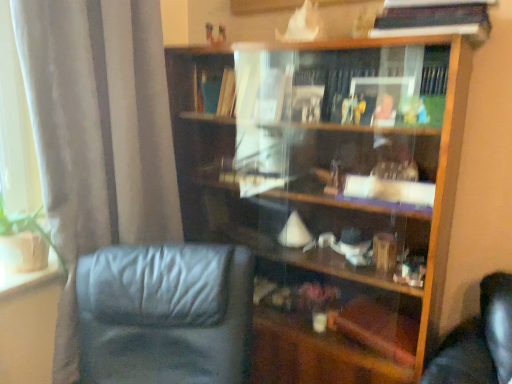
The image size is (512, 384). I want to click on wooden bookcase at center, so click(x=327, y=192).

Describe the element at coordinates (98, 134) in the screenshot. I see `satin gray curtain at left` at that location.

The width and height of the screenshot is (512, 384). Describe the element at coordinates (165, 314) in the screenshot. I see `black leather chair at lower left` at that location.

I want to click on hardcover book at upper right, so click(x=434, y=20).

Is hardcover book at upper right taller or shorter than black leather chair at lower left?

Clearly, hardcover book at upper right is shorter compared to black leather chair at lower left.

Is black leather chair at lower left completely or partially inside hardcover book at upper right?

Answer: Actually, black leather chair at lower left is outside hardcover book at upper right.

Is hardcover book at upper right touching black leather chair at lower left?

No, hardcover book at upper right is not in contact with black leather chair at lower left.

How distant is hardcover book at upper right from black leather chair at lower left?

A distance of 3.53 feet exists between hardcover book at upper right and black leather chair at lower left.

From the image's perspective, between black leather chair at lower left and wooden bookcase at center, who is located below?

black leather chair at lower left, from the image's perspective.

Which object is closer to the camera taking this photo, black leather chair at lower left or wooden bookcase at center?

black leather chair at lower left is in front.

Considering the relative sizes of black leather chair at lower left and wooden bookcase at center in the image provided, is black leather chair at lower left thinner than wooden bookcase at center?

Incorrect, the width of black leather chair at lower left is not less than that of wooden bookcase at center.

Between point (100, 320) and point (168, 79), which one is positioned in front?

Positioned in front is point (100, 320).

Is wooden bookcase at center aimed at black leather chair at lower left?

Yes, wooden bookcase at center is aimed at black leather chair at lower left.

Is there a large distance between wooden bookcase at center and black leather chair at lower left?

No, wooden bookcase at center is in close proximity to black leather chair at lower left.

Consider the image. Is black leather chair at lower left inside wooden bookcase at center?

No, black leather chair at lower left is not surrounded by wooden bookcase at center.

From a real-world perspective, is wooden bookcase at center positioned under black leather chair at lower left based on gravity?

No.

From the picture: Considering the relative sizes of black leather chair at lower left and hardcover book at upper right in the image provided, is black leather chair at lower left taller than hardcover book at upper right?

Correct, black leather chair at lower left is much taller as hardcover book at upper right.

Which point is more distant from viewer, (231, 377) or (396, 34)?

The point (231, 377) is more distant.

Image resolution: width=512 pixels, height=384 pixels. In order to click on chair that appears in front of the hardcover book at upper right in this screenshot , I will do `click(165, 314)`.

Could hardcover book at upper right be considered to be inside black leather chair at lower left?

No, hardcover book at upper right is not a part of black leather chair at lower left.

Does hardcover book at upper right come in front of satin gray curtain at left?

No, hardcover book at upper right is further to the viewer.

I want to click on curtain on the left of hardcover book at upper right, so click(x=98, y=134).

From the image's perspective, is hardcover book at upper right located beneath satin gray curtain at left?

Actually, hardcover book at upper right appears above satin gray curtain at left in the image.

Is hardcover book at upper right not near satin gray curtain at left?

hardcover book at upper right is positioned a significant distance from satin gray curtain at left.

Is black leather chair at lower left shorter than satin gray curtain at left?

Indeed, black leather chair at lower left has a lesser height compared to satin gray curtain at left.

Do you think black leather chair at lower left is within satin gray curtain at left, or outside of it?

black leather chair at lower left exists outside the volume of satin gray curtain at left.

From a real-world perspective, is black leather chair at lower left located higher than satin gray curtain at left?

Incorrect, from a real-world perspective, black leather chair at lower left is lower than satin gray curtain at left.

Between satin gray curtain at left and wooden bookcase at center, which one appears on the left side from the viewer's perspective?

satin gray curtain at left.

Would you say satin gray curtain at left is outside wooden bookcase at center?

Indeed, satin gray curtain at left is completely outside wooden bookcase at center.

Is point (45, 170) positioned after point (285, 349)?

No, (45, 170) is in front of (285, 349).

From the image's perspective, is satin gray curtain at left under wooden bookcase at center?

Incorrect, from the image's perspective, satin gray curtain at left is higher than wooden bookcase at center.

At what (x,y) coordinates should I click in order to perform the action: click on chair in front of the hardcover book at upper right. Please return your answer as a coordinate pair (x, y). The width and height of the screenshot is (512, 384). Looking at the image, I should click on (165, 314).

This screenshot has height=384, width=512. In order to click on bookcase located above the black leather chair at lower left (from the image's perspective) in this screenshot , I will do `click(327, 192)`.

Looking at the image, which one is located further to black leather chair at lower left, hardcover book at upper right or satin gray curtain at left?

The object further to black leather chair at lower left is hardcover book at upper right.

Consider the image. From the image, which object appears to be farther from wooden bookcase at center, satin gray curtain at left or black leather chair at lower left?

black leather chair at lower left is further to wooden bookcase at center.

From the image, which object appears to be nearer to hardcover book at upper right, wooden bookcase at center or satin gray curtain at left?

wooden bookcase at center.

When comparing their distances from black leather chair at lower left, does satin gray curtain at left or wooden bookcase at center seem further?

wooden bookcase at center lies further to black leather chair at lower left than the other object.

From the image, which object appears to be nearer to black leather chair at lower left, hardcover book at upper right or wooden bookcase at center?

Among the two, wooden bookcase at center is located nearer to black leather chair at lower left.

Looking at the image, which one is located further to hardcover book at upper right, wooden bookcase at center or black leather chair at lower left?

black leather chair at lower left.

Estimate the real-world distances between objects in this image. Which object is closer to satin gray curtain at left, hardcover book at upper right or wooden bookcase at center?

wooden bookcase at center is positioned closer to the anchor satin gray curtain at left.

Based on the photo, which object lies nearer to the anchor point hardcover book at upper right, black leather chair at lower left or satin gray curtain at left?

satin gray curtain at left is positioned closer to the anchor hardcover book at upper right.

Locate an element on the screen. This screenshot has height=384, width=512. bookcase between hardcover book at upper right and black leather chair at lower left in the up-down direction is located at coordinates (327, 192).

Find the location of a particular element. chair between satin gray curtain at left and wooden bookcase at center from left to right is located at coordinates (165, 314).

The height and width of the screenshot is (384, 512). What are the coordinates of `bookcase between satin gray curtain at left and hardcover book at upper right` in the screenshot? It's located at (327, 192).

Identify the location of chair between satin gray curtain at left and hardcover book at upper right in the horizontal direction. The image size is (512, 384). (165, 314).